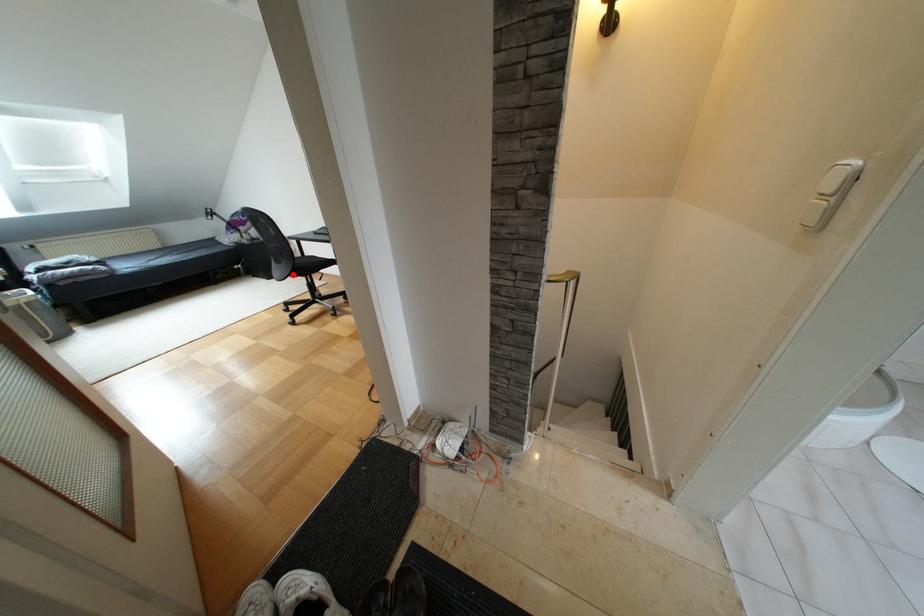
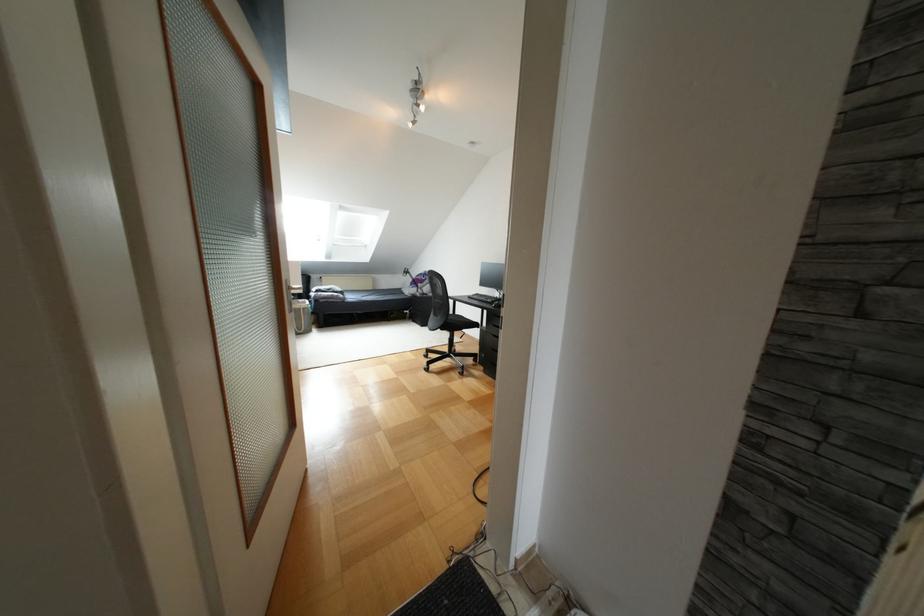
Find the pixel in the second image that matches the highlighted location in the first image.

(442, 328)